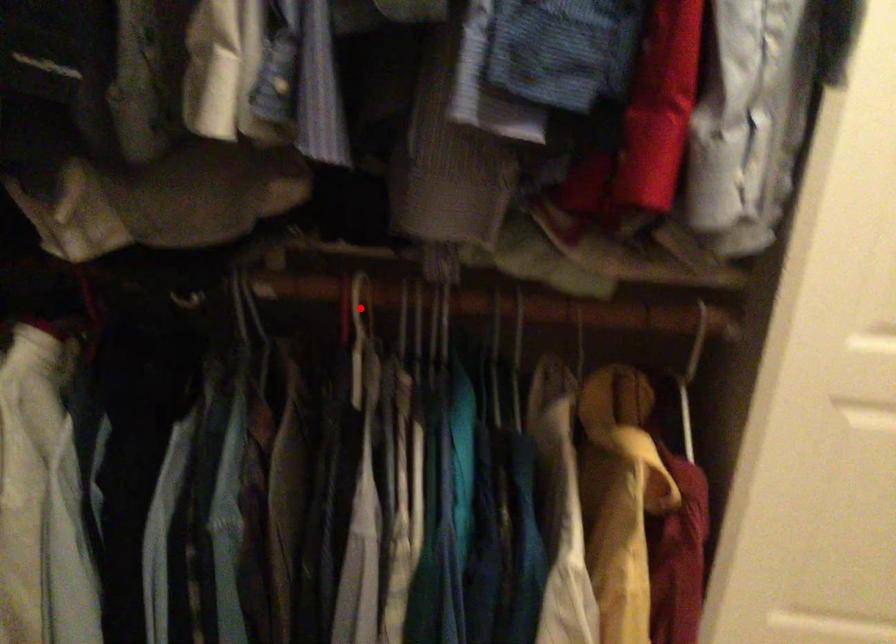
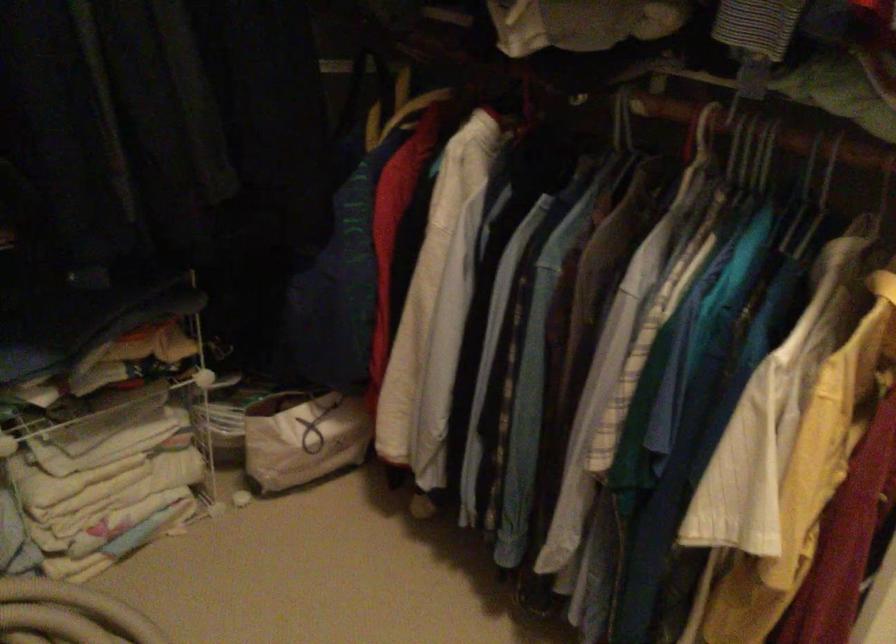
Find the pixel in the second image that matches the highlighted location in the first image.

(702, 134)